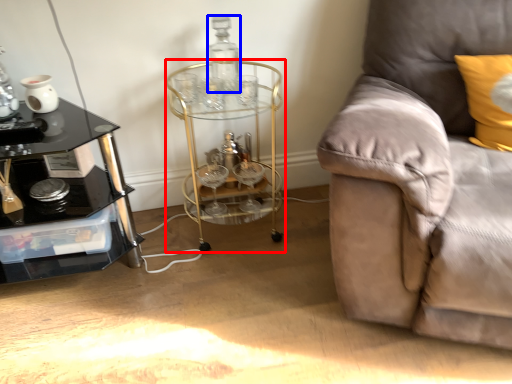
Question: Which object is closer to the camera taking this photo, round table (highlighted by a red box) or bottle (highlighted by a blue box)?

Choices:
 (A) round table
 (B) bottle

Answer: (A)